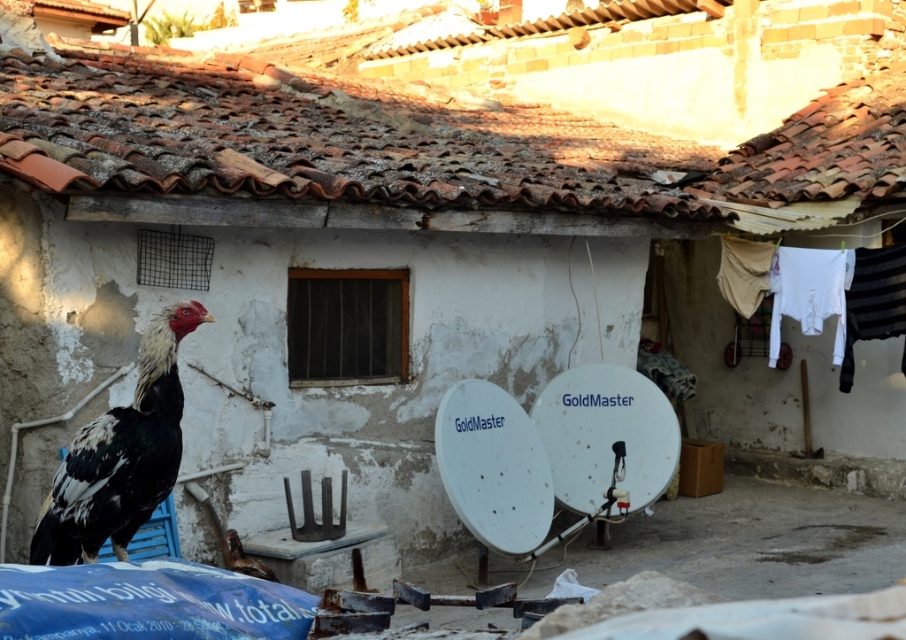
Question: Among these points, which one is farthest from the camera?

Choices:
 (A) click(x=155, y=412)
 (B) click(x=268, y=573)
 (C) click(x=613, y=186)

Answer: (C)

Question: Can you confirm if brown tile roof at upper center is smaller than speckled feathered rooster at left?

Choices:
 (A) no
 (B) yes

Answer: (A)

Question: Which point is closer to the camera?

Choices:
 (A) (234, 566)
 (B) (114, 467)

Answer: (B)

Question: Based on their relative distances, which object is nearer to the speckled feathered rooster at left?

Choices:
 (A) brown feathered chicken at lower center
 (B) brown tile roof at upper center

Answer: (A)

Question: Does speckled feathered rooster at left have a greater width compared to brown feathered chicken at lower center?

Choices:
 (A) yes
 (B) no

Answer: (A)

Question: Is brown tile roof at upper center above brown feathered chicken at lower center?

Choices:
 (A) yes
 (B) no

Answer: (A)